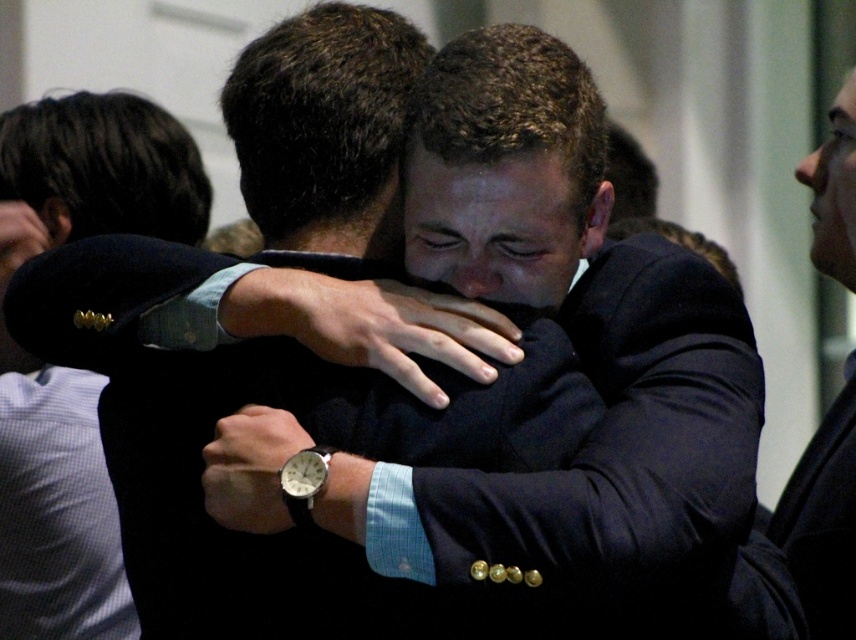
Question: Does dark blue suit at right have a greater width compared to black leather watch at center?

Choices:
 (A) yes
 (B) no

Answer: (A)

Question: Which object is the closest to the matte black suit sleeve at center?

Choices:
 (A) navy blue suit at center
 (B) black fabric arm at center

Answer: (B)

Question: Which point is farther from the camera taking this photo?

Choices:
 (A) (94, 595)
 (B) (247, 314)

Answer: (A)

Question: Does dark blue suit at right come in front of black leather watch at center?

Choices:
 (A) no
 (B) yes

Answer: (A)

Question: Which object is farther from the camera taking this photo?

Choices:
 (A) black fabric arm at center
 (B) matte black suit sleeve at center

Answer: (B)

Question: Is the position of navy blue suit at center more distant than that of black leather watch at center?

Choices:
 (A) no
 (B) yes

Answer: (B)